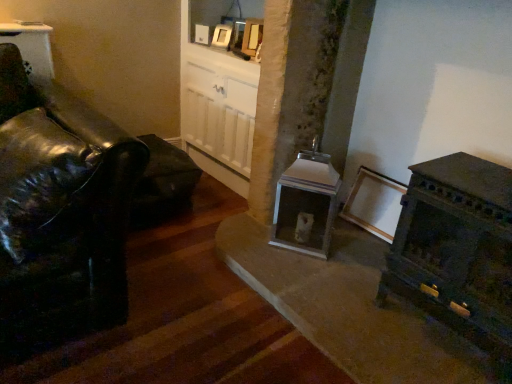
Where is `free space in front of metallic silver fireplace at center`? Image resolution: width=512 pixels, height=384 pixels. free space in front of metallic silver fireplace at center is located at coordinates (296, 279).